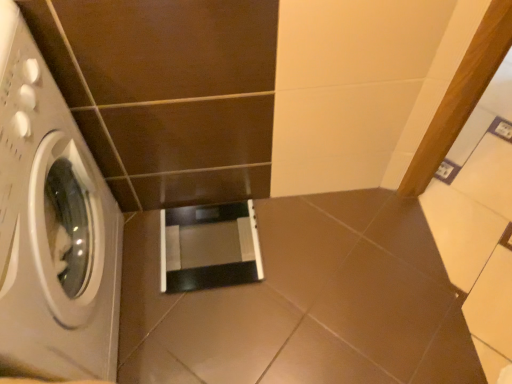
Find the location of a particular element. white glossy washing machine at left is located at coordinates (52, 227).

The height and width of the screenshot is (384, 512). Describe the element at coordinates (52, 227) in the screenshot. I see `white glossy washing machine at left` at that location.

Find the location of a particular element. The image size is (512, 384). white glossy washing machine at left is located at coordinates (52, 227).